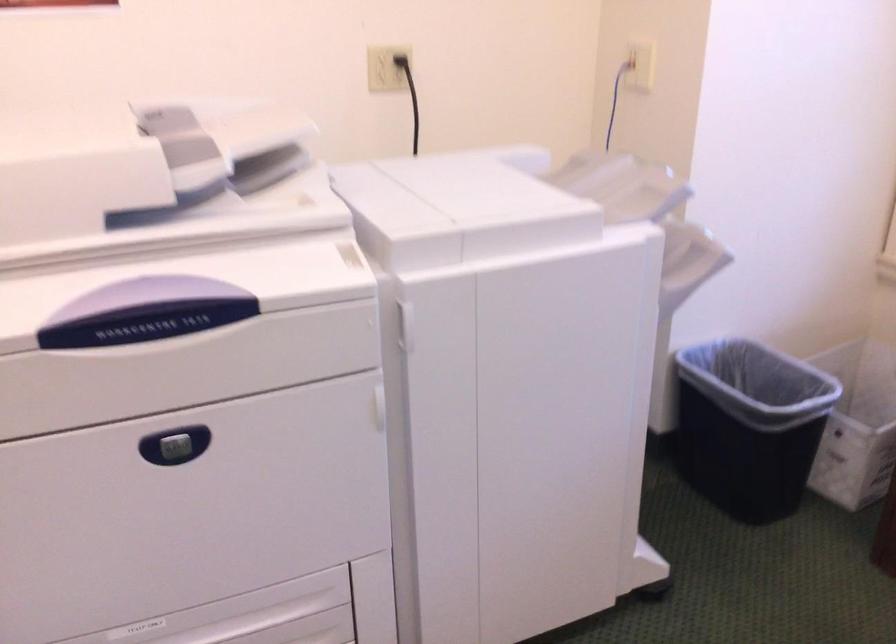
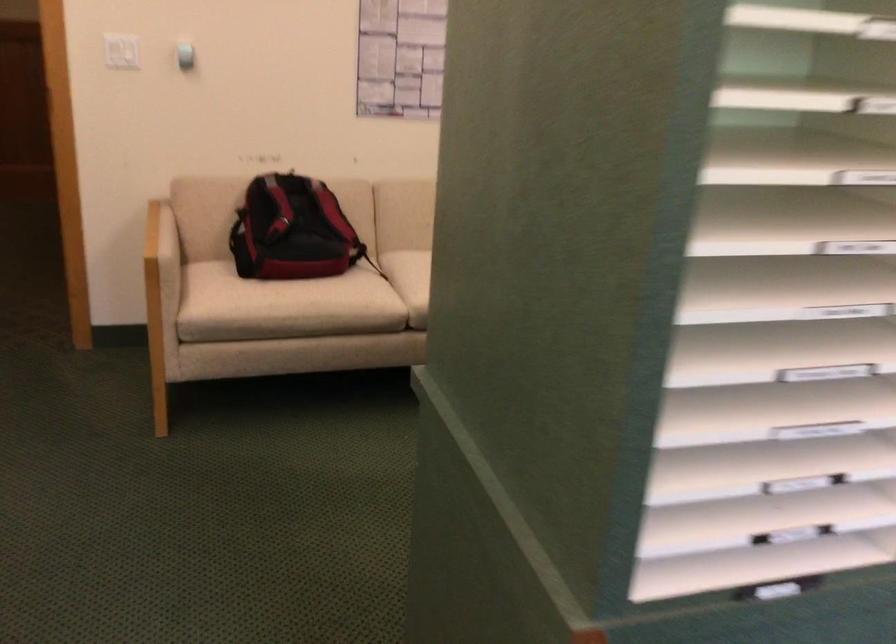
The images are taken continuously from a first-person perspective. In which direction is your viewpoint rotating?

The rotation direction of the camera is left-down.